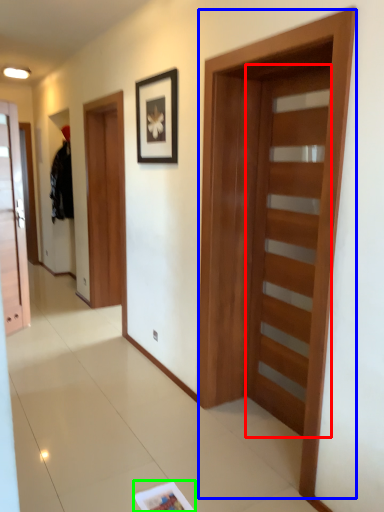
Question: Which is farther away from door (highlighted by a red box)? barn door (highlighted by a blue box) or magazine (highlighted by a green box)?

Choices:
 (A) barn door
 (B) magazine

Answer: (B)